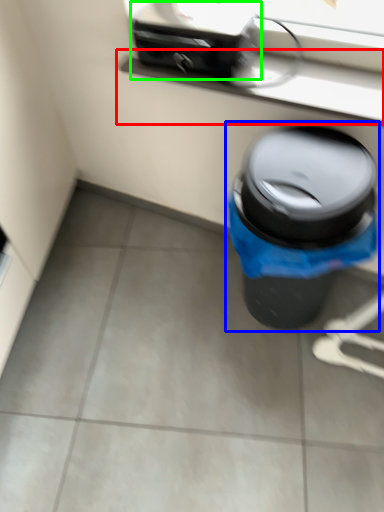
Question: Based on their relative distances, which object is nearer to window sill (highlighted by a red box)? Choose from waste container (highlighted by a blue box) and appliance (highlighted by a green box).

Choices:
 (A) waste container
 (B) appliance

Answer: (B)